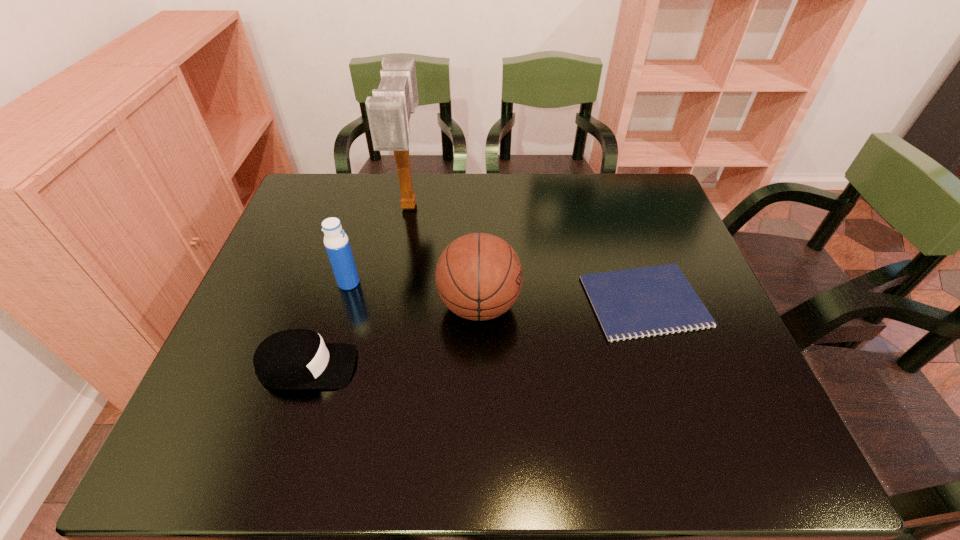
Identify the location of vacant region located on the front of the water bottle. The width and height of the screenshot is (960, 540). (312, 414).

This screenshot has height=540, width=960. What are the coordinates of `free space located 0.080m on the front-facing side of the cap` in the screenshot? It's located at (393, 367).

The height and width of the screenshot is (540, 960). Find the location of `free space located on the front of the notepad`. free space located on the front of the notepad is located at coordinates (687, 428).

Image resolution: width=960 pixels, height=540 pixels. What are the coordinates of `object present at the far edge` in the screenshot? It's located at (389, 110).

What are the coordinates of `object located at the left edge` in the screenshot? It's located at (292, 359).

Where is `object positioned at the right edge`? The width and height of the screenshot is (960, 540). object positioned at the right edge is located at coordinates (648, 301).

Identify the location of free region at the far edge of the desktop. This screenshot has width=960, height=540. (495, 184).

The width and height of the screenshot is (960, 540). Identify the location of free space at the near edge of the desktop. (415, 449).

Identify the location of free space at the left edge. The width and height of the screenshot is (960, 540). point(288,254).

The height and width of the screenshot is (540, 960). I want to click on vacant space at the right edge of the desktop, so click(x=694, y=275).